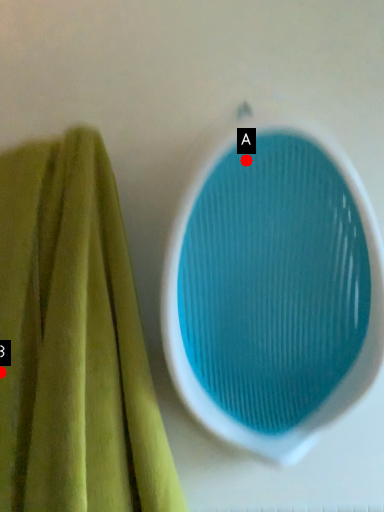
Question: Two points are circled on the image, labeled by A and B beside each circle. Among these points, which one is nearest to the camera?

Choices:
 (A) A is closer
 (B) B is closer

Answer: (A)